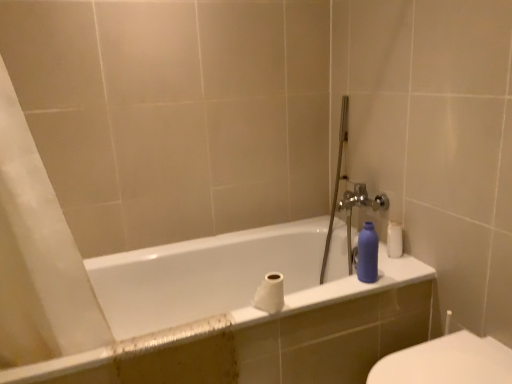
Question: Is white glossy toilet at lower right turned away from white glossy bathtub at center?

Choices:
 (A) no
 (B) yes

Answer: (A)

Question: Is white glossy toilet at lower right to the right of white glossy bathtub at center from the viewer's perspective?

Choices:
 (A) no
 (B) yes

Answer: (B)

Question: Is the depth of white glossy toilet at lower right greater than that of white glossy bathtub at center?

Choices:
 (A) no
 (B) yes

Answer: (A)

Question: Is white glossy toilet at lower right bigger than white glossy bathtub at center?

Choices:
 (A) yes
 (B) no

Answer: (B)

Question: From a real-world perspective, is white glossy toilet at lower right physically above white glossy bathtub at center?

Choices:
 (A) yes
 (B) no

Answer: (A)

Question: From the image's perspective, is white glossy toilet at lower right located above white glossy bathtub at center?

Choices:
 (A) no
 (B) yes

Answer: (A)

Question: Is matte plastic bottle at right completely or partially inside white glossy bathtub at center?

Choices:
 (A) no
 (B) yes

Answer: (A)

Question: Considering the relative sizes of white glossy bathtub at center and matte plastic bottle at right in the image provided, is white glossy bathtub at center thinner than matte plastic bottle at right?

Choices:
 (A) no
 (B) yes

Answer: (A)

Question: Can you confirm if white glossy bathtub at center is positioned to the left of matte plastic bottle at right?

Choices:
 (A) yes
 (B) no

Answer: (A)

Question: Considering the relative sizes of white glossy bathtub at center and matte plastic bottle at right in the image provided, is white glossy bathtub at center smaller than matte plastic bottle at right?

Choices:
 (A) no
 (B) yes

Answer: (A)

Question: Can you confirm if white glossy bathtub at center is positioned to the right of matte plastic bottle at right?

Choices:
 (A) no
 (B) yes

Answer: (A)

Question: Does white glossy bathtub at center have a greater height compared to matte plastic bottle at right?

Choices:
 (A) no
 (B) yes

Answer: (B)

Question: Is white glossy toilet at lower right a part of white glossy bathtub at center?

Choices:
 (A) yes
 (B) no

Answer: (B)